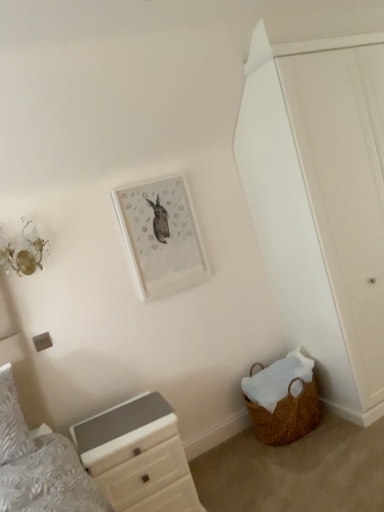
Question: Is brown woven basket at lower right thinner than matte white picture frame at upper center?

Choices:
 (A) yes
 (B) no

Answer: (B)

Question: Is brown woven basket at lower right to the left of matte white picture frame at upper center from the viewer's perspective?

Choices:
 (A) no
 (B) yes

Answer: (A)

Question: Would you consider brown woven basket at lower right to be distant from matte white picture frame at upper center?

Choices:
 (A) no
 (B) yes

Answer: (A)

Question: Can you confirm if brown woven basket at lower right is taller than matte white picture frame at upper center?

Choices:
 (A) no
 (B) yes

Answer: (A)

Question: Is brown woven basket at lower right at the right side of matte white picture frame at upper center?

Choices:
 (A) no
 (B) yes

Answer: (B)

Question: In terms of height, does matte white picture frame at upper center look taller or shorter compared to white textured pillow at left?

Choices:
 (A) short
 (B) tall

Answer: (B)

Question: Does point (206, 262) appear closer or farther from the camera than point (9, 386)?

Choices:
 (A) closer
 (B) farther

Answer: (B)

Question: In terms of size, does matte white picture frame at upper center appear bigger or smaller than white textured pillow at left?

Choices:
 (A) small
 (B) big

Answer: (B)

Question: Relative to white textured pillow at left, is matte white picture frame at upper center in front or behind?

Choices:
 (A) front
 (B) behind

Answer: (B)

Question: Is point (331, 151) positioned closer to the camera than point (8, 407)?

Choices:
 (A) closer
 (B) farther

Answer: (B)

Question: Visually, is white matte door at right positioned to the left or to the right of white textured pillow at left?

Choices:
 (A) right
 (B) left

Answer: (A)

Question: Looking at their shapes, would you say white matte door at right is wider or thinner than white textured pillow at left?

Choices:
 (A) wide
 (B) thin

Answer: (A)

Question: Is white matte door at right in front of or behind white textured pillow at left in the image?

Choices:
 (A) behind
 (B) front

Answer: (A)

Question: From a real-world perspective, is white matte door at right above or below white glossy chest of drawers at lower left?

Choices:
 (A) above
 (B) below

Answer: (A)

Question: Considering the positions of white matte door at right and white glossy chest of drawers at lower left in the image, is white matte door at right bigger or smaller than white glossy chest of drawers at lower left?

Choices:
 (A) small
 (B) big

Answer: (B)